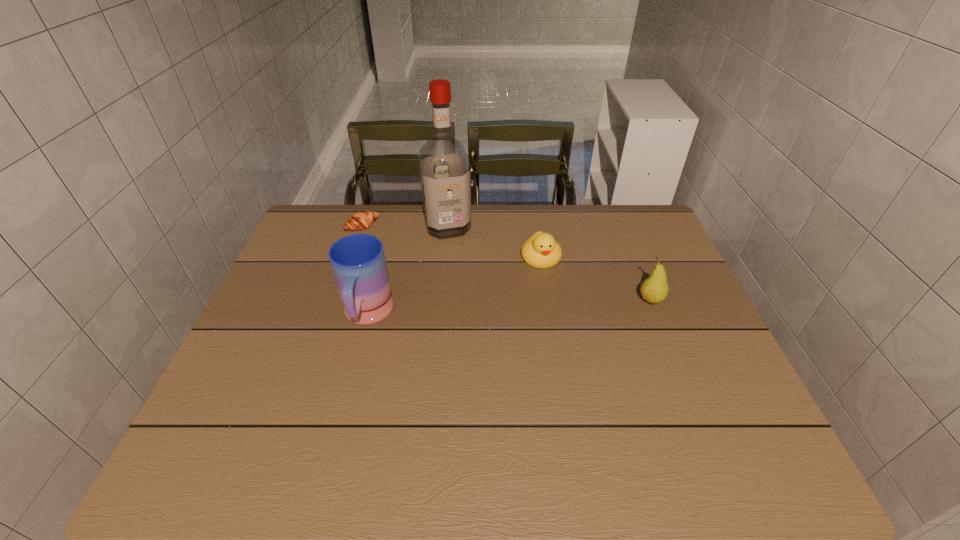
Where is `pastry that is at the far edge`? Image resolution: width=960 pixels, height=540 pixels. pastry that is at the far edge is located at coordinates (x=361, y=220).

The image size is (960, 540). Find the location of `duckling located at the far edge`. duckling located at the far edge is located at coordinates (541, 250).

What are the coordinates of `object located at the left edge` in the screenshot? It's located at (361, 220).

The height and width of the screenshot is (540, 960). I want to click on object positioned at the right edge, so (x=654, y=289).

Image resolution: width=960 pixels, height=540 pixels. What are the coordinates of `object located in the far left corner section of the desktop` in the screenshot? It's located at (361, 220).

In the image, there is a desktop. Identify the location of free region at the far edge. (498, 207).

You are a GUI agent. You are given a task and a screenshot of the screen. Output one action in this format:
    pyautogui.click(x=<x>, y=<y>)
    Task: Click on the vacant space at the near edge of the desktop
    The image size is (960, 540).
    Given the screenshot: What is the action you would take?
    pyautogui.click(x=621, y=409)

Locate an element on the screen. This screenshot has height=540, width=960. blank space at the left edge is located at coordinates (327, 290).

Find the location of a particular element. free spot at the right edge of the desktop is located at coordinates (693, 317).

In order to click on free space at the far left corner in this screenshot , I will do `click(330, 247)`.